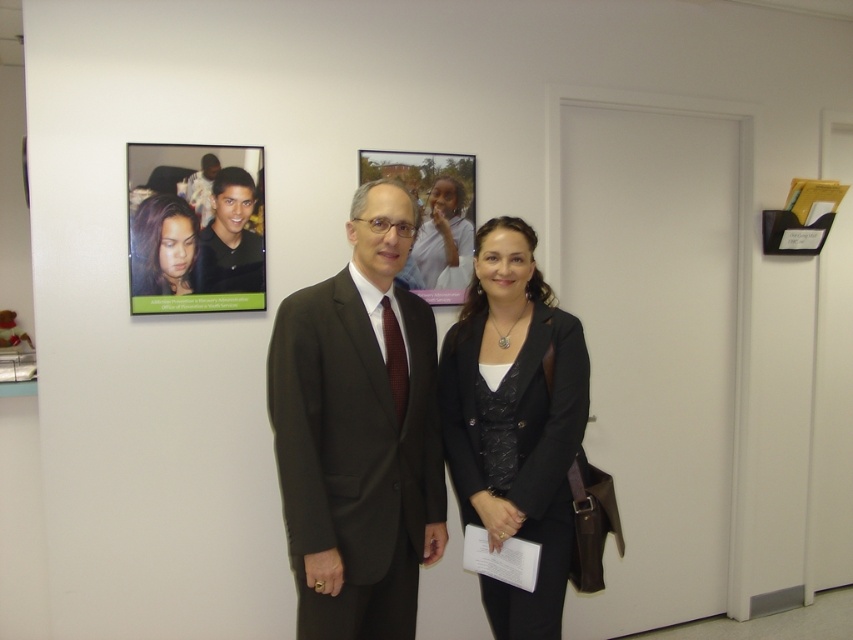
How distant is dark gray suit at center from matte black photo at upper left?

dark gray suit at center and matte black photo at upper left are 28.00 inches apart from each other.

Looking at this image, does dark gray suit at center appear on the left side of matte black photo at upper left?

In fact, dark gray suit at center is to the right of matte black photo at upper left.

This screenshot has height=640, width=853. Identify the location of dark gray suit at center. (358, 432).

Who is positioned more to the right, dark gray suit at center or matte black hair at upper left?

dark gray suit at center is more to the right.

Who is lower down, dark gray suit at center or matte black hair at upper left?

dark gray suit at center

In order to click on dark gray suit at center in this screenshot , I will do `click(358, 432)`.

Measure the distance between dark gray suit at center and camera.

A distance of 5.94 feet exists between dark gray suit at center and camera.

I want to click on dark gray suit at center, so click(x=358, y=432).

You are a GUI agent. You are given a task and a screenshot of the screen. Output one action in this format:
    pyautogui.click(x=<x>, y=<y>)
    Task: Click on the dark gray suit at center
    This screenshot has height=640, width=853.
    Given the screenshot: What is the action you would take?
    pyautogui.click(x=358, y=432)